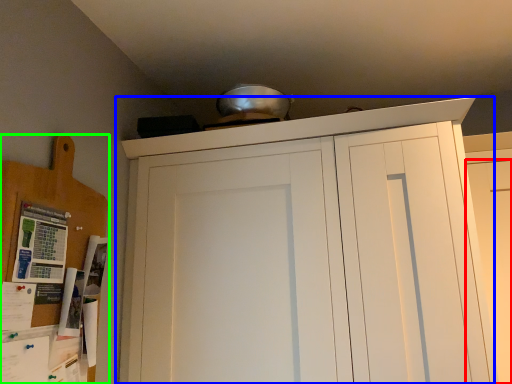
Question: Considering the real-world distances, which object is closest to door (highlighted by a red box)? cupboard (highlighted by a blue box) or cabinetry (highlighted by a green box).

Choices:
 (A) cupboard
 (B) cabinetry

Answer: (A)